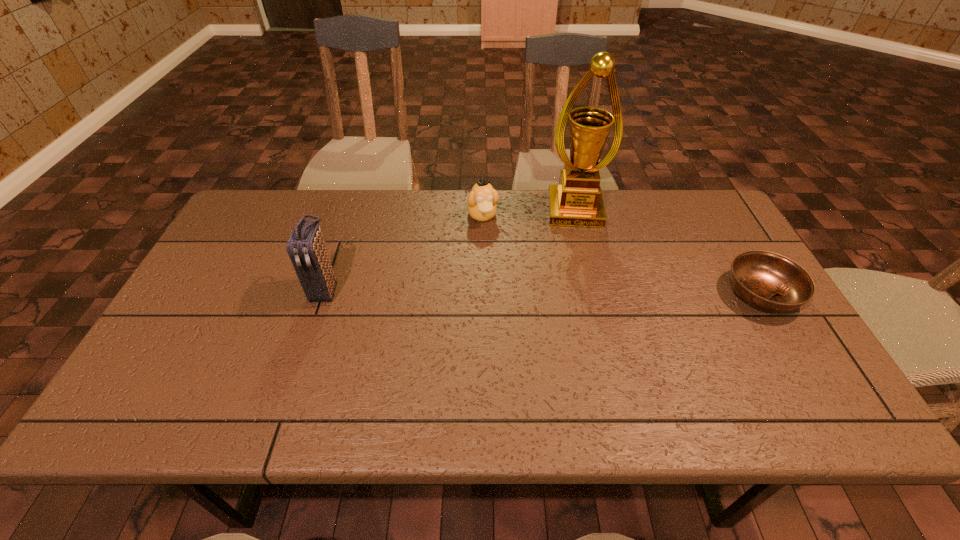
This screenshot has width=960, height=540. In the image, there is a desktop. Find the location of `vacant space at the near edge`. vacant space at the near edge is located at coordinates pos(649,370).

In the image, there is a desktop. Identify the location of vacant space at the left edge. (235, 292).

The image size is (960, 540). What are the coordinates of `vacant space at the right edge` in the screenshot? It's located at (683, 240).

At what (x,y) coordinates should I click in order to perform the action: click on vacant space at the far left corner of the desktop. Please return your answer as a coordinate pair (x, y). The width and height of the screenshot is (960, 540). Looking at the image, I should click on (281, 197).

Locate an element on the screen. This screenshot has width=960, height=540. vacant region at the near left corner is located at coordinates (207, 363).

The width and height of the screenshot is (960, 540). In order to click on free space at the far right corner of the desktop in this screenshot , I will do `click(722, 231)`.

You are a GUI agent. You are given a task and a screenshot of the screen. Output one action in this format:
    pyautogui.click(x=<x>, y=<y>)
    Task: Click on the vacant space at the near right corner of the desktop
    The height and width of the screenshot is (540, 960).
    Given the screenshot: What is the action you would take?
    pyautogui.click(x=786, y=380)

At what (x,y) coordinates should I click in order to perform the action: click on free spot between the second object from right to left and the second tallest object. Please return your answer as a coordinate pair (x, y). This screenshot has height=540, width=960. Looking at the image, I should click on (450, 250).

Where is `vacant space in between the shortest object and the duckling`? The image size is (960, 540). vacant space in between the shortest object and the duckling is located at coordinates (622, 254).

Locate an element on the screen. vacant area that lies between the soup bowl and the second object from left to right is located at coordinates (622, 254).